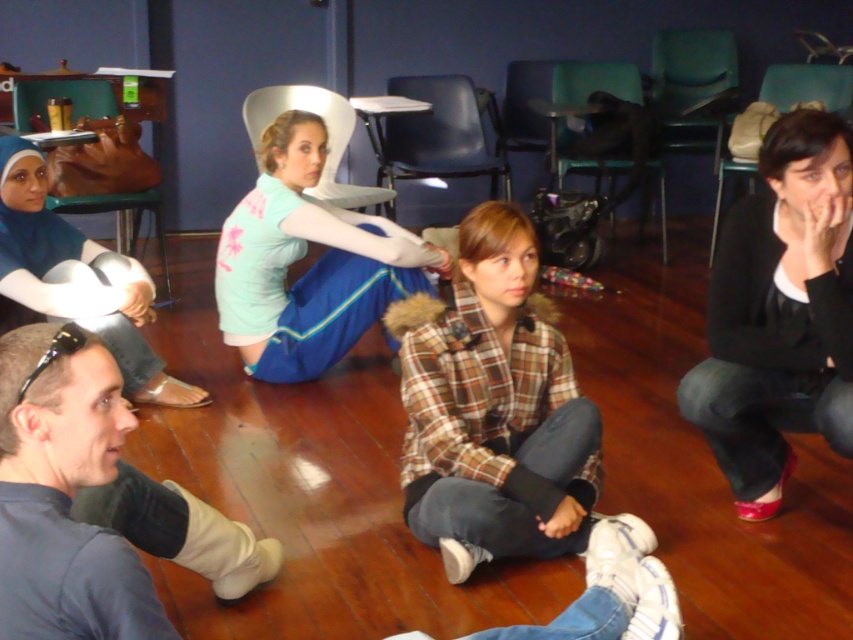
Question: Which point is farther from the camera taking this photo?

Choices:
 (A) (573, 436)
 (B) (303, 189)
 (C) (647, 550)

Answer: (B)

Question: Which point is farther to the camera?

Choices:
 (A) (123, 493)
 (B) (39, 282)
 (C) (795, 422)
 (D) (444, 369)

Answer: (B)

Question: Which of the following is the farthest from the observer?

Choices:
 (A) light blue fabric skirt at center
 (B) dark blue shirt at lower left
 (C) blue denim jeans at lower center

Answer: (A)

Question: Can you confirm if plaid fabric shirt at center is bigger than blue denim jeans at lower center?

Choices:
 (A) no
 (B) yes

Answer: (B)

Question: Does plaid fabric shirt at center appear under blue fabric hijab at upper left?

Choices:
 (A) no
 (B) yes

Answer: (B)

Question: Where is plaid fabric shirt at center located in relation to blue denim jeans at lower center in the image?

Choices:
 (A) right
 (B) left

Answer: (B)